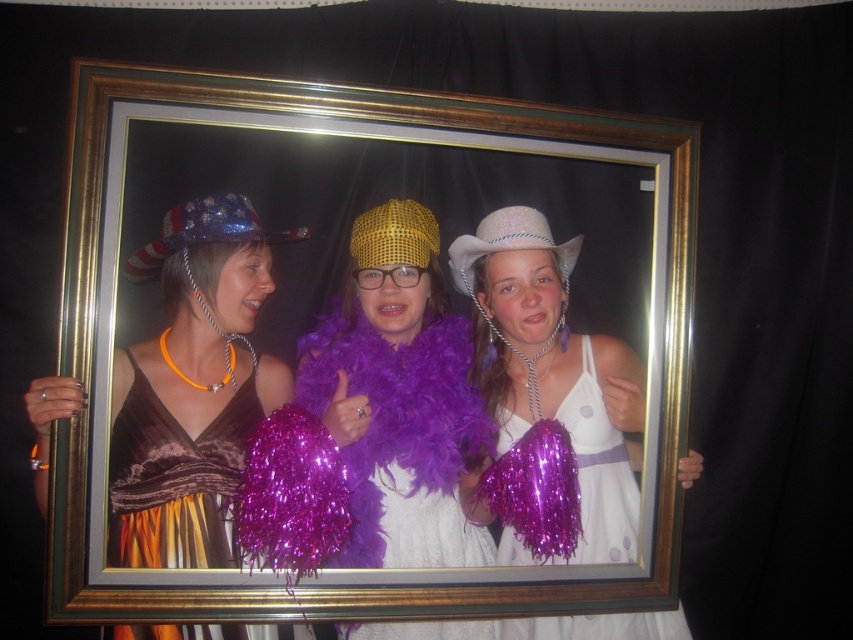
Who is more forward, (369,248) or (624,490)?

Point (369,248)

Between purple feather boa at center and white matte dress at center, which one is positioned lower?

white matte dress at center is below.

The width and height of the screenshot is (853, 640). Describe the element at coordinates (399, 397) in the screenshot. I see `purple feather boa at center` at that location.

The image size is (853, 640). I want to click on purple feather boa at center, so click(399, 397).

Based on the photo, does gold/metallic picture frame at center have a lesser height compared to shiny metallic dress at left?

In fact, gold/metallic picture frame at center may be taller than shiny metallic dress at left.

Consider the image. Measure the distance between gold/metallic picture frame at center and camera.

gold/metallic picture frame at center is 5.13 feet from camera.

At what (x,y) coordinates should I click in order to perform the action: click on gold/metallic picture frame at center. Please return your answer as a coordinate pair (x, y). Looking at the image, I should click on (367, 356).

Does purple feather boa at center appear on the right side of shiny gold mesh hat at center?

Correct, you'll find purple feather boa at center to the right of shiny gold mesh hat at center.

Is point (422, 324) positioned behind point (428, 241)?

Yes, it is behind point (428, 241).

I want to click on purple feather boa at center, so click(x=399, y=397).